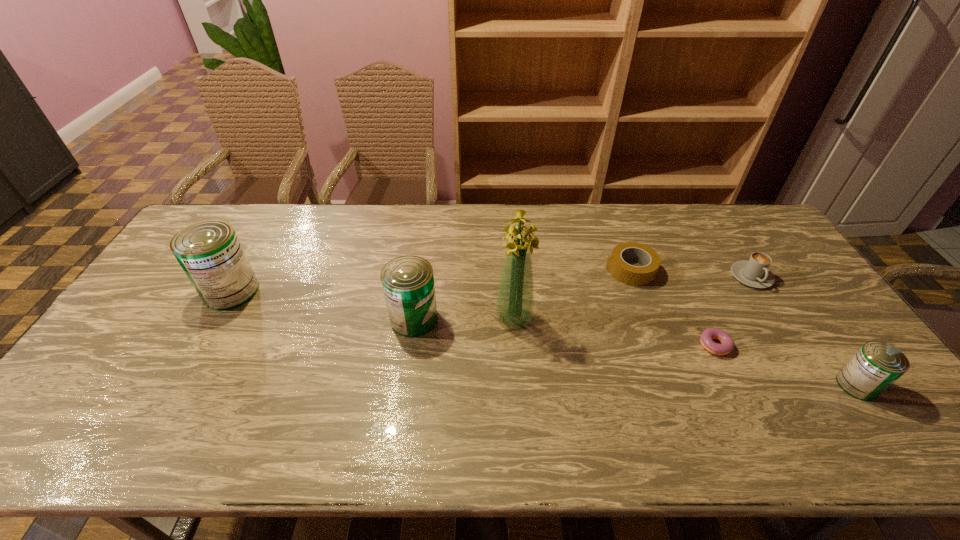
Find the location of a particular element. The image size is (960, 540). vacant area between the second shortest can and the leftmost object is located at coordinates coord(323,305).

The width and height of the screenshot is (960, 540). I want to click on vacant point located between the cappuccino and the fifth object from right to left, so click(x=633, y=297).

Find the location of a particular element. vacant point located between the sixth object from right to left and the rightmost can is located at coordinates (636, 352).

Identify the location of free space between the doughnut and the shortest can. (786, 366).

At what (x,y) coordinates should I click in order to perform the action: click on vacant region between the shortest object and the cappuccino. Please return your answer as a coordinate pair (x, y). The width and height of the screenshot is (960, 540). Looking at the image, I should click on (733, 311).

Where is `blank region between the third shortest object and the nearest object`? blank region between the third shortest object and the nearest object is located at coordinates (804, 331).

Image resolution: width=960 pixels, height=540 pixels. Find the location of `empty space that is in between the fifth tallest object and the bouquet`. empty space that is in between the fifth tallest object and the bouquet is located at coordinates (633, 297).

The image size is (960, 540). What are the coordinates of `free space between the third object from left to right and the shortest object` in the screenshot? It's located at (614, 332).

Image resolution: width=960 pixels, height=540 pixels. I want to click on vacant point located between the doughnut and the second can from right to left, so click(x=564, y=332).

Where is `empty location between the fifth object from right to left and the cappuccino`? The image size is (960, 540). empty location between the fifth object from right to left and the cappuccino is located at coordinates (633, 297).